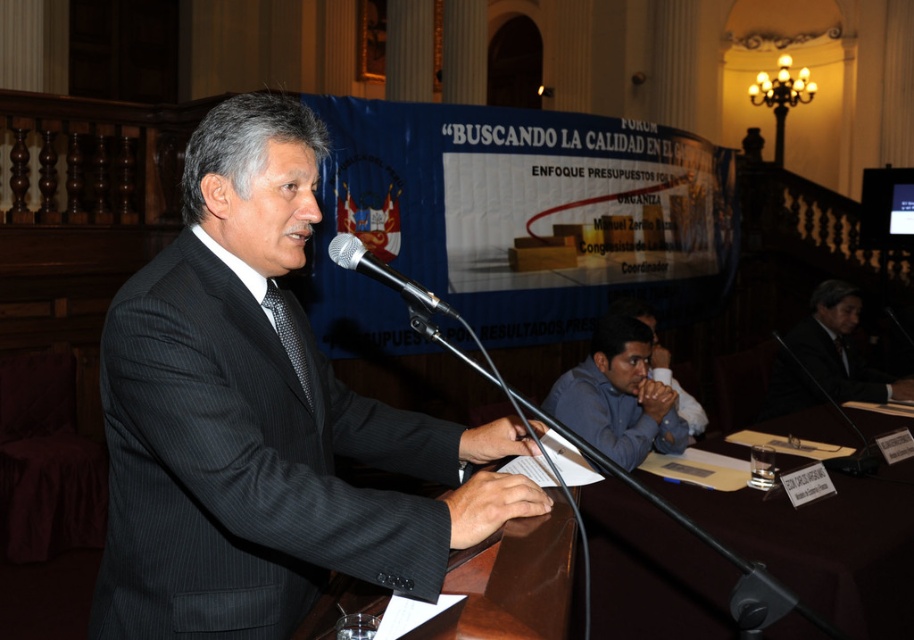
Question: Is brown wooden table at center to the left of black dotted tie at center from the viewer's perspective?

Choices:
 (A) yes
 (B) no

Answer: (B)

Question: Which point appears closest to the camera in this image?

Choices:
 (A) (646, 429)
 (B) (283, 337)
 (C) (656, 490)
 (D) (344, 253)

Answer: (D)

Question: Which of the following is the closest to the observer?

Choices:
 (A) (264, 301)
 (B) (664, 374)
 (C) (213, 474)
 (D) (636, 493)

Answer: (C)

Question: Where is blue shirt at lower right located in relation to black dotted tie at center in the image?

Choices:
 (A) above
 (B) below

Answer: (B)

Question: Where is blue shirt at lower right located in relation to black dotted tie at center in the image?

Choices:
 (A) above
 (B) below

Answer: (B)

Question: Among these points, which one is farthest from the camera?

Choices:
 (A) (120, 545)
 (B) (697, 417)
 (C) (592, 492)
 (D) (277, 301)

Answer: (B)